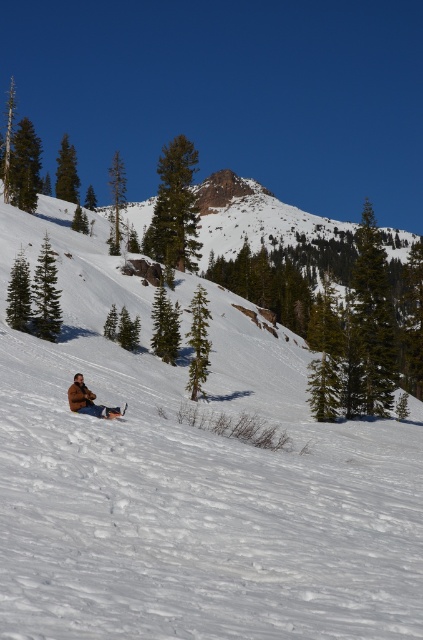
You are standing at the bottom of the snow hill in the winter scene. You see the brown fuzzy jacket at lower left. If you want to reach it, in which direction should you move relative to the slope?

Since the brown fuzzy jacket at lower left is located at point 0.627 on the x axis and 0.210 on the y axis, you should move towards the lower left direction relative to the slope to reach it.

You are standing at the bottom of the slope and see the brown fuzzy jacket at lower left and the white plastic snowboard at lower center. Which object is closer to your left side?

The brown fuzzy jacket at lower left is closer to your left side since it is positioned to the left of the white plastic snowboard at lower center.

You are standing on the slope and see the white powdery snow at center and the brown fuzzy jacket at lower left. Which object is higher up the slope?

The white powdery snow at center is positioned over the brown fuzzy jacket at lower left, so it is higher up the slope.